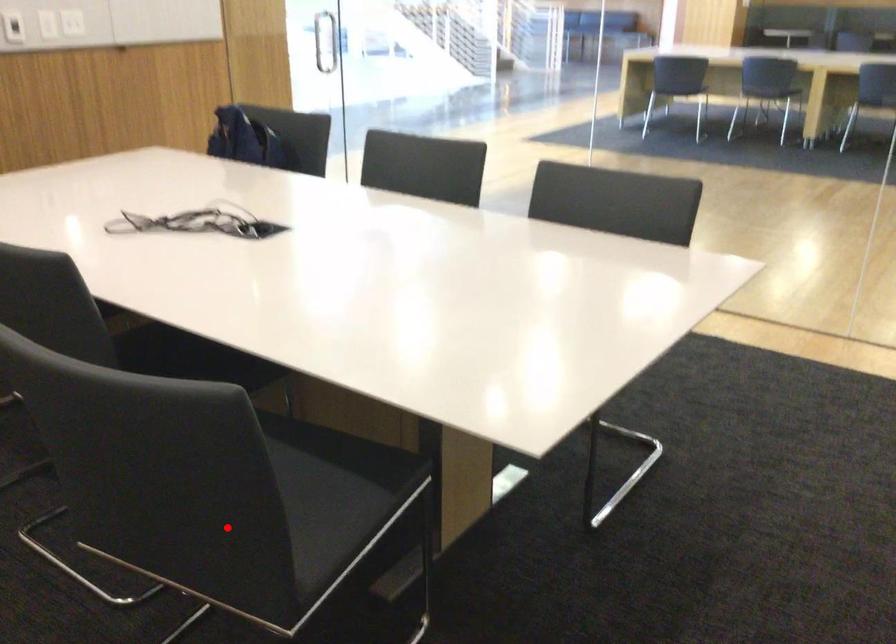
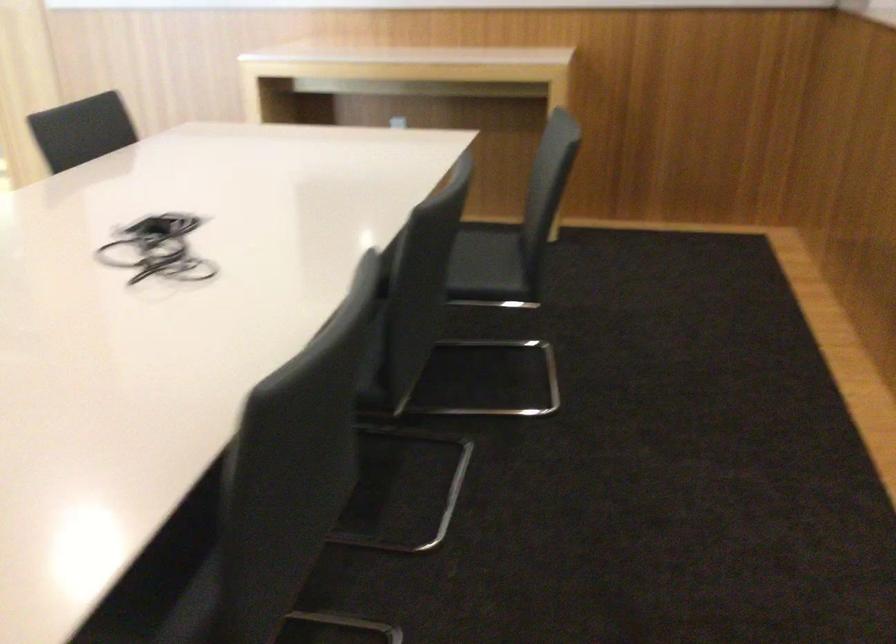
Question: A red point is marked in image1. In image2, is the corresponding 3D point closer to the camera or farther? Reply with the corresponding letter.

Choices:
 (A) The corresponding 3D point is closer.
 (B) The corresponding 3D point is farther.

Answer: (B)